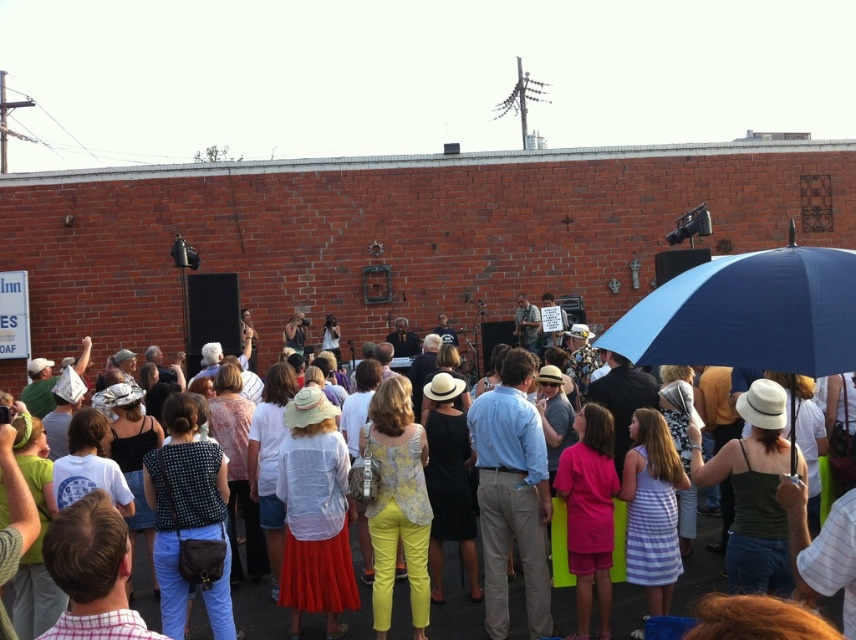
You are standing at the red brick wall and looking towards the crowd. There are two points marked in the image, point A at coordinates point (682, 273) and point B at coordinates point (513, 593). Which point is closer to you?

Point B at coordinates point (513, 593) is closer to you because it is less further to the camera than point A at coordinates point (682, 273).

You are attending an outdoor event and notice a blue matte umbrella at upper right and a matte white shirt at center. Which object appears smaller in the image?

The blue matte umbrella at upper right appears smaller than the matte white shirt at center.

You are attending an outdoor event and notice a blue matte umbrella at upper right and a matte white shirt at center. Which object is positioned higher in the scene?

The blue matte umbrella at upper right is positioned higher than the matte white shirt at center in the scene.